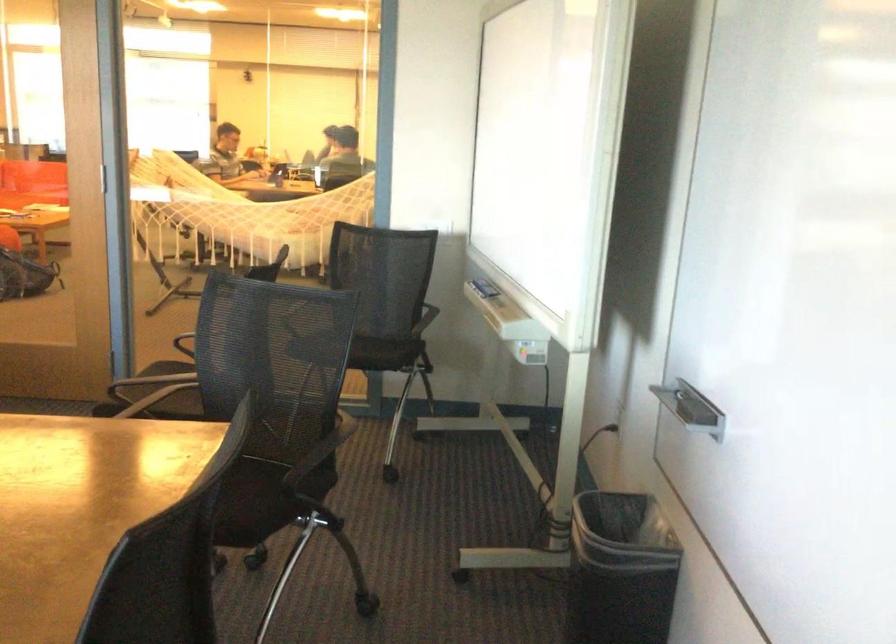
Where would you ly the hammock sitting surface? Please return your answer as a coordinate pair (x, y).

(246, 213)